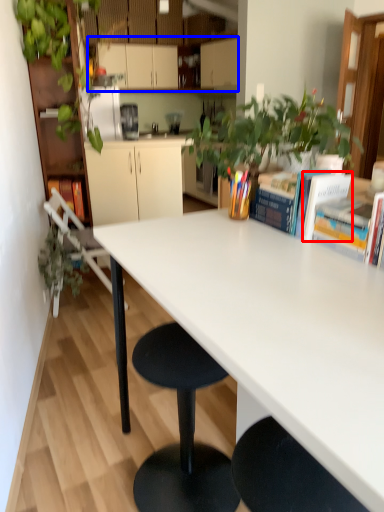
Question: Which object appears closest to the camera in this image, book (highlighted by a red box) or cabinetry (highlighted by a blue box)?

Choices:
 (A) book
 (B) cabinetry

Answer: (A)